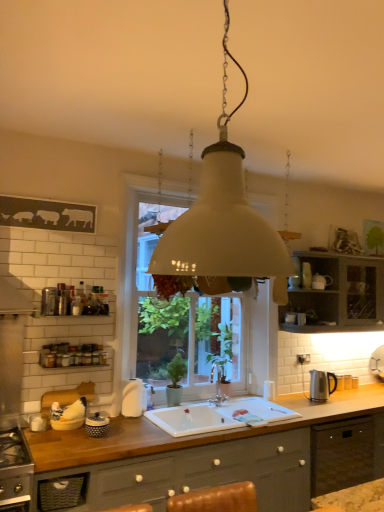
Locate an element on the screen. free location in front of white matte soap dispenser at center, the 2th appliance positioned from the right is located at coordinates (134, 421).